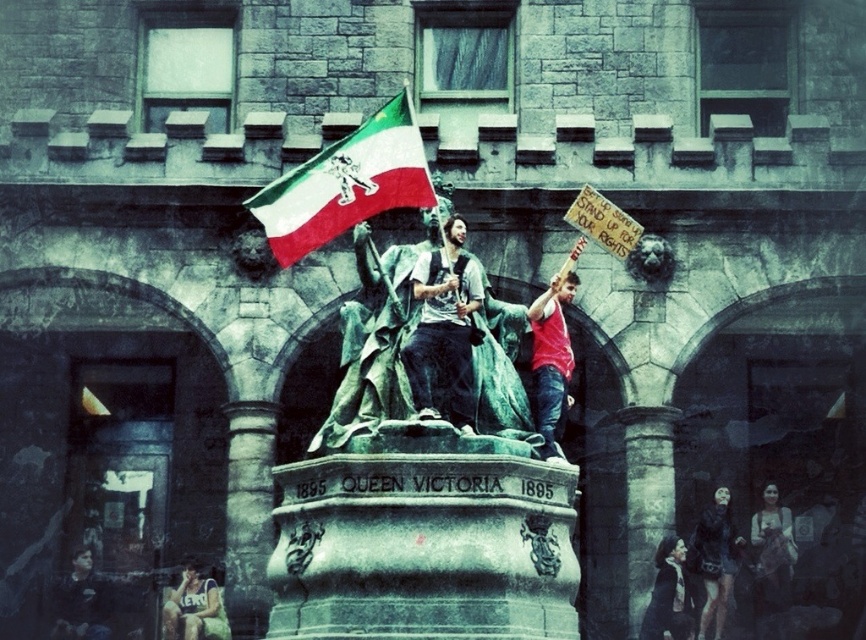
The width and height of the screenshot is (866, 640). What do you see at coordinates (551, 360) in the screenshot? I see `red cotton tank top at upper center` at bounding box center [551, 360].

Who is higher up, red cotton tank top at upper center or black leather jacket at lower right?

red cotton tank top at upper center is higher up.

This screenshot has width=866, height=640. In order to click on red cotton tank top at upper center in this screenshot , I will do `click(551, 360)`.

Where is `red cotton tank top at upper center`? red cotton tank top at upper center is located at coordinates (551, 360).

Can you confirm if white and green fabric flag at upper center is wider than matte blue tank top at lower left?

Indeed, white and green fabric flag at upper center has a greater width compared to matte blue tank top at lower left.

Between white and green fabric flag at upper center and matte blue tank top at lower left, which one appears on the right side from the viewer's perspective?

Positioned to the right is white and green fabric flag at upper center.

Which is in front, point (365, 200) or point (183, 611)?

Point (365, 200)

Locate an element on the screen. white and green fabric flag at upper center is located at coordinates (347, 182).

Between white and green fabric flag at upper center and black leather jacket at lower right, which one appears on the left side from the viewer's perspective?

white and green fabric flag at upper center

How much distance is there between white and green fabric flag at upper center and black leather jacket at lower right?

white and green fabric flag at upper center is 66.12 feet away from black leather jacket at lower right.

Where is `white and green fabric flag at upper center`? white and green fabric flag at upper center is located at coordinates (347, 182).

Where is `white and green fabric flag at upper center`? white and green fabric flag at upper center is located at coordinates (347, 182).